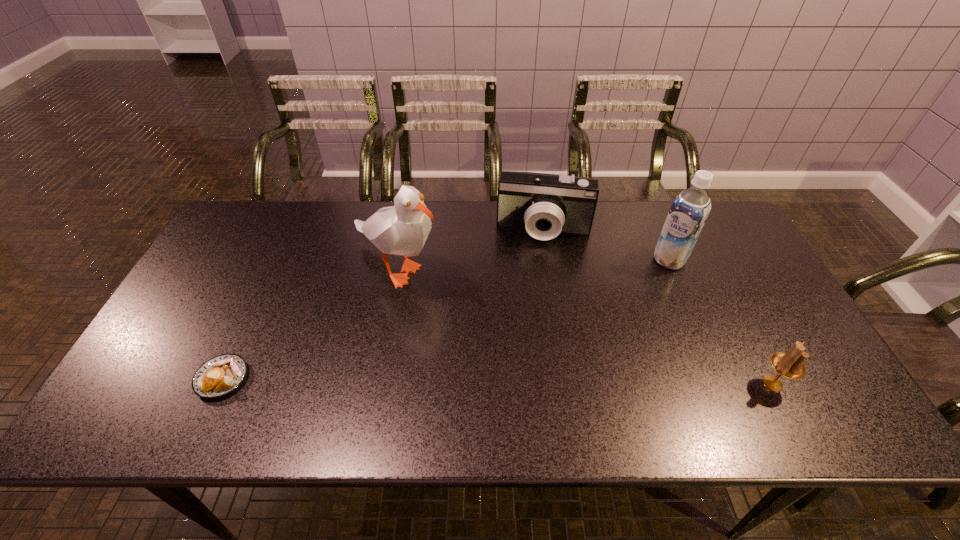
In the image, there is a desktop. Identify the location of blank space at the near left corner. The height and width of the screenshot is (540, 960). (184, 389).

The image size is (960, 540). What are the coordinates of `vacant point at the far right corner` in the screenshot? It's located at (714, 226).

You are a GUI agent. You are given a task and a screenshot of the screen. Output one action in this format:
    pyautogui.click(x=<x>, y=<y>)
    Task: Click on the vacant space that is in between the rightmost object and the leftmost object
    
    Given the screenshot: What is the action you would take?
    pyautogui.click(x=497, y=381)

At what (x,y) coordinates should I click in order to perform the action: click on free point between the gull and the candle holder. Please return your answer as a coordinate pair (x, y). Image resolution: width=960 pixels, height=540 pixels. Looking at the image, I should click on point(585,325).

Identify the location of free area in between the soya milk and the shortest object. (445, 319).

The width and height of the screenshot is (960, 540). Find the location of `vacant space that's between the soya milk and the candle holder`. vacant space that's between the soya milk and the candle holder is located at coordinates (721, 321).

Locate an element on the screen. The image size is (960, 540). free space between the fourth object from left to right and the third object from right to left is located at coordinates (607, 245).

Locate an element on the screen. Image resolution: width=960 pixels, height=540 pixels. empty location between the soya milk and the camcorder is located at coordinates (607, 245).

I want to click on unoccupied area between the candle holder and the soya milk, so click(x=721, y=321).

At what (x,y) coordinates should I click in order to perform the action: click on free space between the gull and the leftmost object. Please return your answer as a coordinate pair (x, y). The width and height of the screenshot is (960, 540). Looking at the image, I should click on (309, 322).